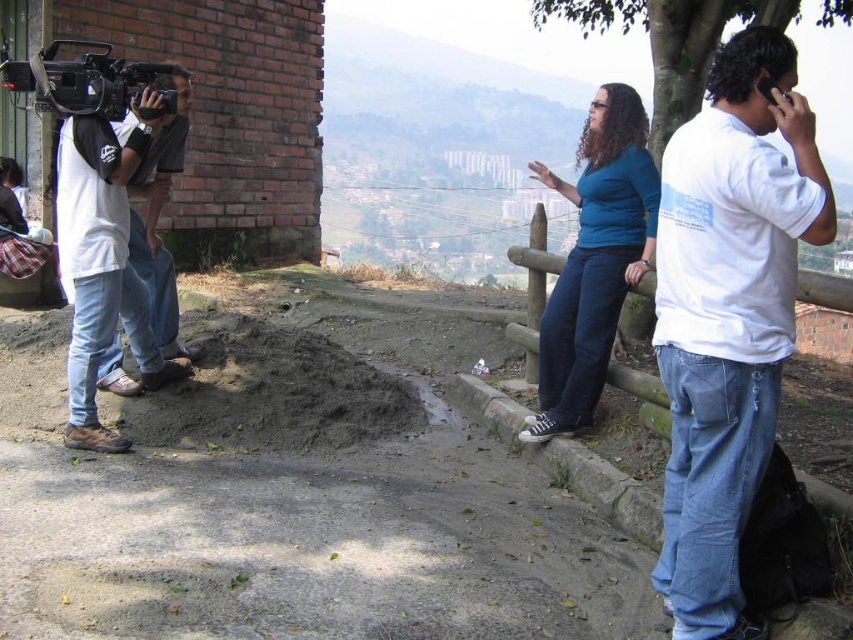
Who is more forward, (90, 396) or (775, 81)?

Point (775, 81) is more forward.

Between brown leather boots at left and black plastic phone at upper right, which one has more height?

brown leather boots at left is taller.

Does point (115, 451) lie in front of point (758, 88)?

That is False.

Locate an element on the screen. brown leather boots at left is located at coordinates (97, 266).

Between brown leather boots at left and black plastic video camera at upper left, which one appears on the left side from the viewer's perspective?

black plastic video camera at upper left is more to the left.

How much distance is there between brown leather boots at left and black plastic video camera at upper left?

They are 29.87 inches apart.

Is point (120, 145) positioned in front of point (107, 45)?

Yes.

Find the location of a particular element. The image size is (853, 640). brown leather boots at left is located at coordinates (97, 266).

Which is behind, point (160, 323) or point (107, 90)?

Point (160, 323)

Is matte black camera at left to the right of black plastic video camera at upper left from the viewer's perspective?

Yes, matte black camera at left is to the right of black plastic video camera at upper left.

Locate an element on the screen. matte black camera at left is located at coordinates (157, 220).